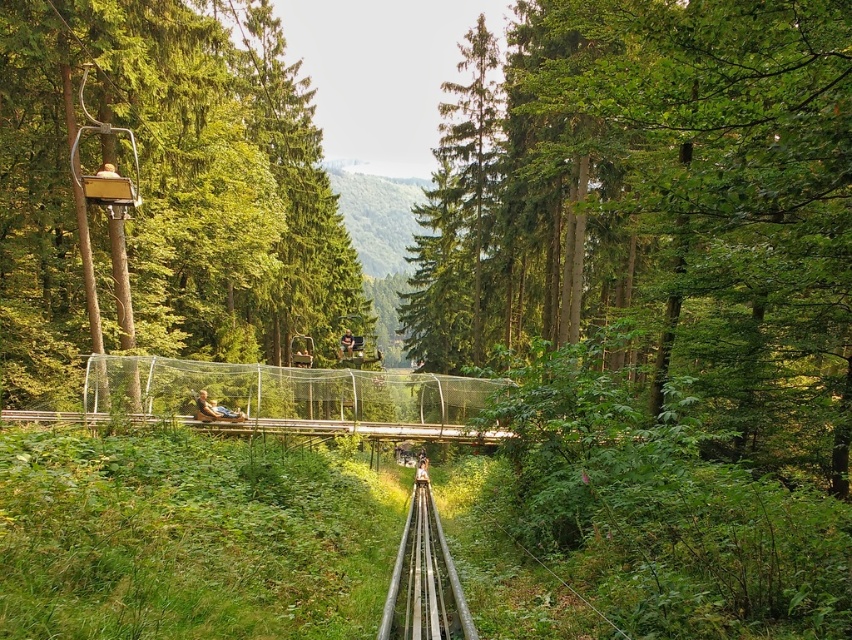
Question: Can you confirm if green leafy tree at center is thinner than green matte tree at left?

Choices:
 (A) yes
 (B) no

Answer: (B)

Question: Which is nearer to the wooden bench at center?

Choices:
 (A) green leafy tree at center
 (B) rustic wooden train track at center

Answer: (A)

Question: Is rustic wooden train track at center bigger than matte black person at center?

Choices:
 (A) yes
 (B) no

Answer: (A)

Question: Among these objects, which one is farthest from the camera?

Choices:
 (A) green leafy tree at center
 (B) rustic wooden train track at center
 (C) matte black person at center

Answer: (C)

Question: Where is green leafy tree at center located in relation to wooden bench at center in the image?

Choices:
 (A) above
 (B) below

Answer: (A)

Question: Which point is closer to the camera?

Choices:
 (A) wooden bench at center
 (B) green matte tree at left
 (C) matte black person at center

Answer: (B)